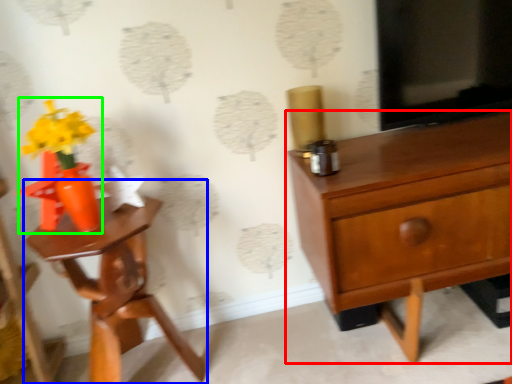
Question: Considering the real-world distances, which object is closest to chest of drawers (highlighted by a red box)? nightstand (highlighted by a blue box) or floral arrangement (highlighted by a green box).

Choices:
 (A) nightstand
 (B) floral arrangement

Answer: (A)